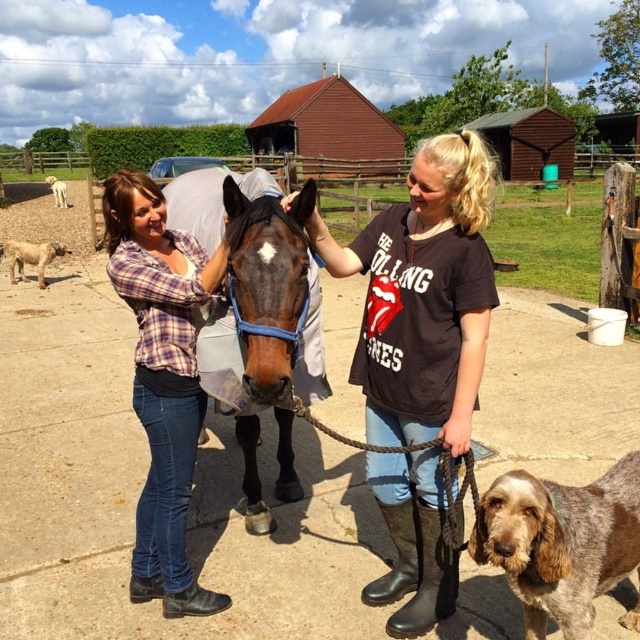
You are a farmer who needs to decide which animal to lead first through a narrow gate that can only accommodate one animal at a time. Based on their sizes, which animal should you lead through first, the brown glossy horse at center or the white fluffy dog at upper left?

The brown glossy horse at center is not as tall as the white fluffy dog at upper left, so you should lead the white fluffy dog at upper left through the gate first since it is taller and might require more space.

You are standing at the origin point of the coordinate system, which is the bottom left corner of the image. The speckled fur dog at lower right is located at coordinates 0.847, 0.877. If you want to walk directly to the dog, in which direction should you move?

To reach the speckled fur dog at lower right located at coordinates (561, 541), you should move northeast since the x and y coordinates are both greater than 0.5, indicating a position in the upper right quadrant. However, since the dog is labeled as being at the lower right, there might be a discrepancy. Wait, the coordinates given are 0.847 in x and 0.877 in y. Assuming the coordinate system has the origin at the bottom left, x increases to the right and y increases upward. Therefore, a point with both